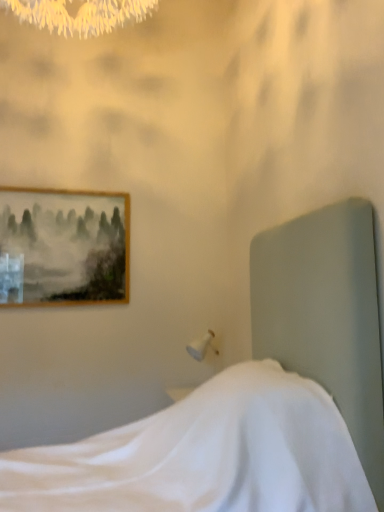
This screenshot has height=512, width=384. Describe the element at coordinates (63, 247) in the screenshot. I see `wooden framed painting at upper left` at that location.

Where is `wooden framed painting at upper left`? The image size is (384, 512). wooden framed painting at upper left is located at coordinates (63, 247).

The image size is (384, 512). I want to click on white fabric bed at center, so [x=326, y=316].

This screenshot has width=384, height=512. What do you see at coordinates (326, 316) in the screenshot? I see `white fabric bed at center` at bounding box center [326, 316].

The height and width of the screenshot is (512, 384). Identify the location of wooden framed painting at upper left. (63, 247).

Between wooden framed painting at upper left and white fabric bed at center, which one appears on the left side from the viewer's perspective?

Positioned to the left is wooden framed painting at upper left.

Based on the photo, which object is closer to the camera taking this photo, wooden framed painting at upper left or white fabric bed at center?

Positioned in front is white fabric bed at center.

Does point (56, 224) lie behind point (331, 435)?

Yes, it is behind point (331, 435).

From the image's perspective, would you say wooden framed painting at upper left is positioned over white fabric bed at center?

Indeed, from the image's perspective, wooden framed painting at upper left is shown above white fabric bed at center.

From a real-world perspective, is wooden framed painting at upper left positioned over white fabric bed at center based on gravity?

Correct, in the physical world, wooden framed painting at upper left is higher than white fabric bed at center.

Between wooden framed painting at upper left and white fabric bed at center, which one has smaller width?

Thinner between the two is wooden framed painting at upper left.

Considering the sizes of objects wooden framed painting at upper left and white fabric bed at center in the image provided, who is taller, wooden framed painting at upper left or white fabric bed at center?

Standing taller between the two is white fabric bed at center.

From the picture: Considering the relative sizes of wooden framed painting at upper left and white fabric bed at center in the image provided, is wooden framed painting at upper left bigger than white fabric bed at center?

Incorrect, wooden framed painting at upper left is not larger than white fabric bed at center.

Is wooden framed painting at upper left inside or outside of white fabric bed at center?

wooden framed painting at upper left lies outside white fabric bed at center.

Is wooden framed painting at upper left beside white fabric bed at center?

No, wooden framed painting at upper left is not beside white fabric bed at center.

Could you tell me if wooden framed painting at upper left is facing white fabric bed at center?

Yes, wooden framed painting at upper left is facing white fabric bed at center.

From the picture: How different are the orientations of wooden framed painting at upper left and white fabric bed at center in degrees?

wooden framed painting at upper left and white fabric bed at center are facing 90.9 degrees away from each other.

This screenshot has height=512, width=384. Identify the location of picture frame on the left of white fabric bed at center. click(63, 247).

Would you say white fabric bed at center is to the left or to the right of wooden framed painting at upper left in the picture?

From the image, it's evident that white fabric bed at center is to the right of wooden framed painting at upper left.

Who is more distant, white fabric bed at center or wooden framed painting at upper left?

wooden framed painting at upper left is further away from the camera.

Is point (372, 482) closer or farther from the camera than point (4, 301)?

Clearly, point (372, 482) is closer to the camera than point (4, 301).

From the image's perspective, is white fabric bed at center on wooden framed painting at upper left?

No, from the image's perspective, white fabric bed at center is not on top of wooden framed painting at upper left.

From the picture: From a real-world perspective, which object rests below the other?

From a 3D spatial view, white fabric bed at center is below.

Considering the sizes of objects white fabric bed at center and wooden framed painting at upper left in the image provided, who is wider, white fabric bed at center or wooden framed painting at upper left?

white fabric bed at center.

Who is taller, white fabric bed at center or wooden framed painting at upper left?

With more height is white fabric bed at center.

From the picture: Is white fabric bed at center smaller than wooden framed painting at upper left?

No.

Is white fabric bed at center outside of wooden framed painting at upper left?

Absolutely, white fabric bed at center is external to wooden framed painting at upper left.

Are white fabric bed at center and wooden framed painting at upper left making contact?

No, white fabric bed at center is not in contact with wooden framed painting at upper left.

Does white fabric bed at center turn towards wooden framed painting at upper left?

No, white fabric bed at center is not facing towards wooden framed painting at upper left.

What's the angular difference between white fabric bed at center and wooden framed painting at upper left's facing directions?

There is a 90.9-degree angle between the facing directions of white fabric bed at center and wooden framed painting at upper left.

Where is `picture frame located behind the white fabric bed at center`? picture frame located behind the white fabric bed at center is located at coordinates (63, 247).

This screenshot has width=384, height=512. In order to click on bed that is under the wooden framed painting at upper left (from a real-world perspective) in this screenshot , I will do `click(326, 316)`.

This screenshot has height=512, width=384. In order to click on bed lying in front of the wooden framed painting at upper left in this screenshot , I will do `click(326, 316)`.